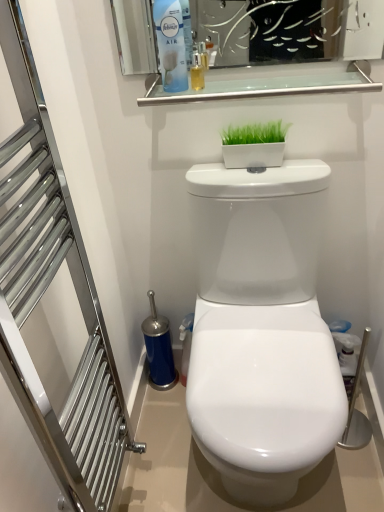
Identify the location of free region under clear glass shelf at upper center (from a real-world perspective). This screenshot has width=384, height=512. (x=256, y=170).